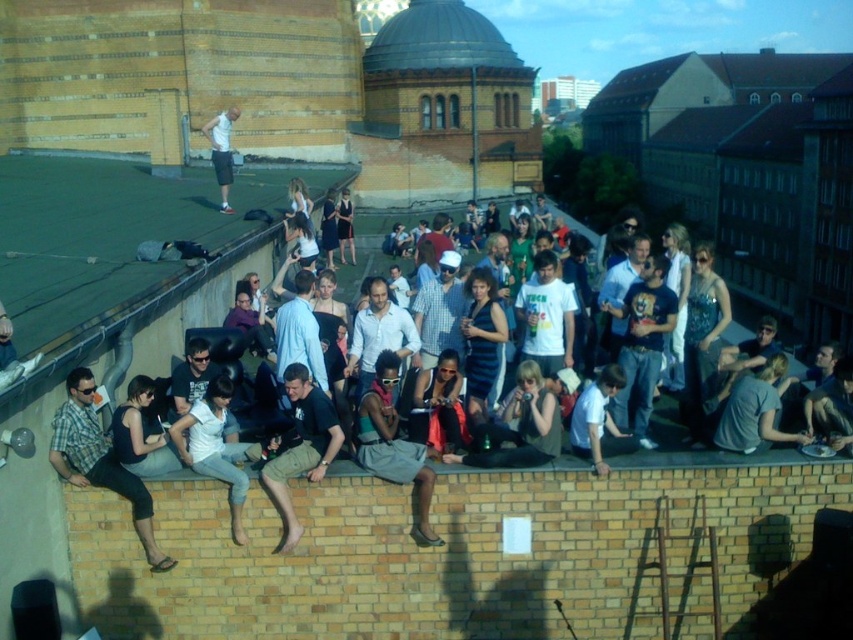
You are a photographer trying to capture a clear shot of the matte black shirt at center and the black cotton shirt at center. Since both are positioned at the center, which one is closer to your camera lens?

The matte black shirt at center is in front of the black cotton shirt at center, so it is closer to the camera lens.

You are at a rooftop event and want to find the matte black shirt at lower left and the green fabric skirt at center. Which one is located more to the left side?

The matte black shirt at lower left is positioned on the left side of green fabric skirt at center, so the matte black shirt at lower left is more to the left.